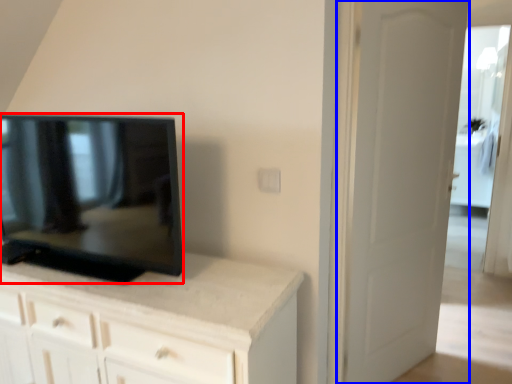
Question: Among these objects, which one is farthest to the camera, television (highlighted by a red box) or door (highlighted by a blue box)?

Choices:
 (A) television
 (B) door

Answer: (B)